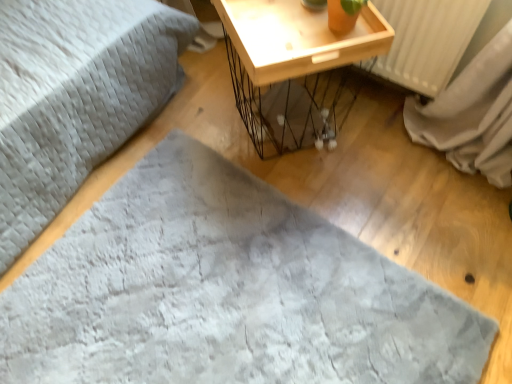
Find the location of a particular element. vacant space to the left of wooden tray at upper right is located at coordinates (194, 109).